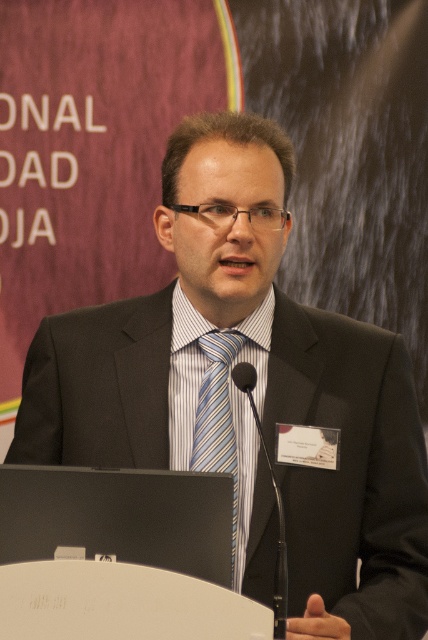
Is point (252, 477) in front of point (223, 467)?

No, it is behind (223, 467).

Is striped cotton dress shirt at center to the right of blue striped tie at center from the viewer's perspective?

Yes, striped cotton dress shirt at center is to the right of blue striped tie at center.

Which is behind, point (267, 337) or point (235, 461)?

Positioned behind is point (267, 337).

This screenshot has width=428, height=640. In order to click on striped cotton dress shirt at center in this screenshot , I will do `click(184, 376)`.